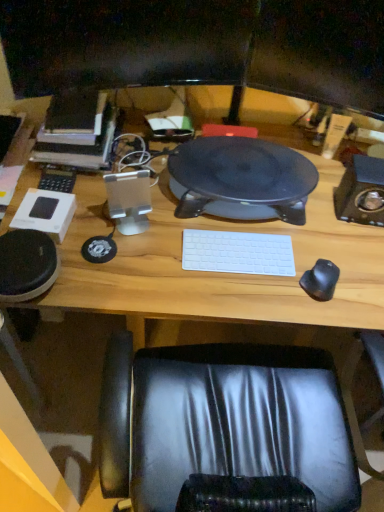
Identify the location of vacant space behind white matte keyboard at center. (241, 223).